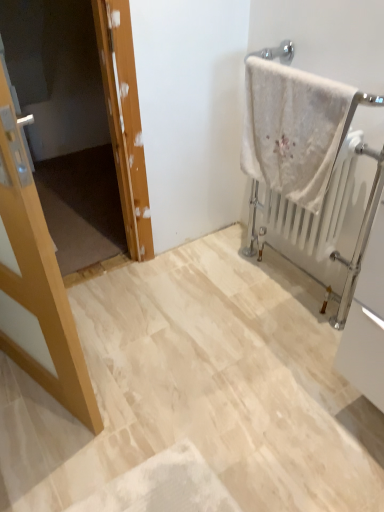
Describe the element at coordinates (292, 129) in the screenshot. The height and width of the screenshot is (512, 384). I see `white fluffy towel at upper right` at that location.

At what (x,y) coordinates should I click in order to perform the action: click on white fluffy towel at upper right. Please return your answer as a coordinate pair (x, y). Looking at the image, I should click on (292, 129).

The height and width of the screenshot is (512, 384). Identify the location of light wood door at left. (36, 284).

The height and width of the screenshot is (512, 384). Describe the element at coordinates (36, 284) in the screenshot. I see `light wood door at left` at that location.

I want to click on white metallic radiator at right, so click(325, 216).

Find the location of `wooden door at left`. wooden door at left is located at coordinates (64, 105).

Is white metallic radiator at right thinner than white fluffy towel at upper right?

No.

Considering the positions of point (335, 200) and point (324, 184), is point (335, 200) closer or farther from the camera than point (324, 184)?

Point (335, 200) is farther from the camera than point (324, 184).

From the picture: From a real-world perspective, is white metallic radiator at right located beneath white fluffy towel at upper right?

Yes, from a real-world perspective, white metallic radiator at right is under white fluffy towel at upper right.

Considering the positions of objects white metallic radiator at right and white fluffy towel at upper right in the image provided, who is more to the left, white metallic radiator at right or white fluffy towel at upper right?

white fluffy towel at upper right is more to the left.

Considering the sizes of objects wooden door at left and white metallic radiator at right in the image provided, who is shorter, wooden door at left or white metallic radiator at right?

white metallic radiator at right.

Looking at their sizes, would you say wooden door at left is wider or thinner than white metallic radiator at right?

wooden door at left is wider than white metallic radiator at right.

Is wooden door at left positioned far away from white metallic radiator at right?

Yes, wooden door at left and white metallic radiator at right are located far from each other.

From a real-world perspective, is wooden door at left on top of white metallic radiator at right?

Indeed, from a real-world perspective, wooden door at left stands above white metallic radiator at right.

From a real-world perspective, does light wood door at left stand above white metallic radiator at right?

Yes, from a real-world perspective, light wood door at left is over white metallic radiator at right

Is point (63, 393) farther from viewer compared to point (342, 304)?

That is False.

Could you tell me if light wood door at left is turned towards white metallic radiator at right?

Yes, light wood door at left is turned towards white metallic radiator at right.

How different are the orientations of light wood door at left and white metallic radiator at right in degrees?

The facing directions of light wood door at left and white metallic radiator at right are 162 degrees apart.

Which of these two, white fluffy towel at upper right or wooden door at left, is wider?

Wider between the two is wooden door at left.

Consider the image. From the image's perspective, is white fluffy towel at upper right positioned above or below wooden door at left?

From the image's perspective, white fluffy towel at upper right appears above wooden door at left.

Is white fluffy towel at upper right positioned beyond the bounds of wooden door at left?

Yes, white fluffy towel at upper right is outside of wooden door at left.

Is point (305, 142) closer to viewer compared to point (15, 86)?

Yes, it is.

Looking at their sizes, would you say white metallic radiator at right is wider or thinner than wooden door at left?

In the image, white metallic radiator at right appears to be more narrow than wooden door at left.

Considering the sizes of objects white metallic radiator at right and wooden door at left in the image provided, who is taller, white metallic radiator at right or wooden door at left?

Standing taller between the two is wooden door at left.

Considering the relative positions of white metallic radiator at right and wooden door at left in the image provided, is white metallic radiator at right to the left or to the right of wooden door at left?

From the image, it's evident that white metallic radiator at right is to the right of wooden door at left.

Is white metallic radiator at right directly adjacent to wooden door at left?

white metallic radiator at right is not next to wooden door at left, and they're not touching.

Considering the relative positions of white metallic radiator at right and light wood door at left in the image provided, is white metallic radiator at right to the left of light wood door at left from the viewer's perspective?

No, white metallic radiator at right is not to the left of light wood door at left.

Between white metallic radiator at right and light wood door at left, which one has more height?

light wood door at left.

From a real-world perspective, who is located lower, white metallic radiator at right or light wood door at left?

From a 3D spatial view, white metallic radiator at right is below.

From the image's perspective, is white metallic radiator at right under light wood door at left?

Actually, white metallic radiator at right appears above light wood door at left in the image.

How different are the orientations of light wood door at left and wooden door at left in degrees?

109 degrees.

Where is `screen door below the light wood door at left (from a real-world perspective)`? This screenshot has width=384, height=512. screen door below the light wood door at left (from a real-world perspective) is located at coordinates (64, 105).

Is point (38, 355) positioned after point (50, 228)?

No, (38, 355) is in front of (50, 228).

Based on the photo, can you confirm if light wood door at left is bigger than wooden door at left?

Correct, light wood door at left is larger in size than wooden door at left.

Locate an element on the screen. Image resolution: width=384 pixels, height=512 pixels. towel that is on the left side of white metallic radiator at right is located at coordinates (292, 129).

Find the location of `radiator on the right of wooden door at left`. radiator on the right of wooden door at left is located at coordinates (325, 216).

Which object lies further to the anchor point white metallic radiator at right, light wood door at left or wooden door at left?

Among the two, wooden door at left is located further to white metallic radiator at right.

Based on their spatial positions, is wooden door at left or light wood door at left further from white fluffy towel at upper right?

wooden door at left lies further to white fluffy towel at upper right than the other object.

From the image, which object appears to be farther from wooden door at left, white metallic radiator at right or white fluffy towel at upper right?

white metallic radiator at right lies further to wooden door at left than the other object.

Which object lies nearer to the anchor point light wood door at left, white fluffy towel at upper right or white metallic radiator at right?

Among the two, white fluffy towel at upper right is located nearer to light wood door at left.

From the image, which object appears to be nearer to white fluffy towel at upper right, wooden door at left or white metallic radiator at right?

Among the two, white metallic radiator at right is located nearer to white fluffy towel at upper right.

Considering their positions, is white fluffy towel at upper right positioned further to wooden door at left than white metallic radiator at right?

Based on the image, white metallic radiator at right appears to be further to wooden door at left.

Considering their positions, is wooden door at left positioned further to light wood door at left than white fluffy towel at upper right?

Among the two, wooden door at left is located further to light wood door at left.

Which object lies further to the anchor point wooden door at left, light wood door at left or white fluffy towel at upper right?

light wood door at left is positioned further to the anchor wooden door at left.

Locate an element on the screen. The image size is (384, 512). screen door between light wood door at left and white metallic radiator at right in the horizontal direction is located at coordinates (64, 105).

At what (x,y) coordinates should I click in order to perform the action: click on screen door between light wood door at left and white fluffy towel at upper right from left to right. Please return your answer as a coordinate pair (x, y). This screenshot has height=512, width=384. Looking at the image, I should click on (64, 105).

You are a GUI agent. You are given a task and a screenshot of the screen. Output one action in this format:
    pyautogui.click(x=<x>, y=<y>)
    Task: Click on the towel between light wood door at left and white metallic radiator at right in the horizontal direction
    The image size is (384, 512).
    Given the screenshot: What is the action you would take?
    [292, 129]

Locate an element on the screen. This screenshot has width=384, height=512. towel between wooden door at left and white metallic radiator at right is located at coordinates [292, 129].